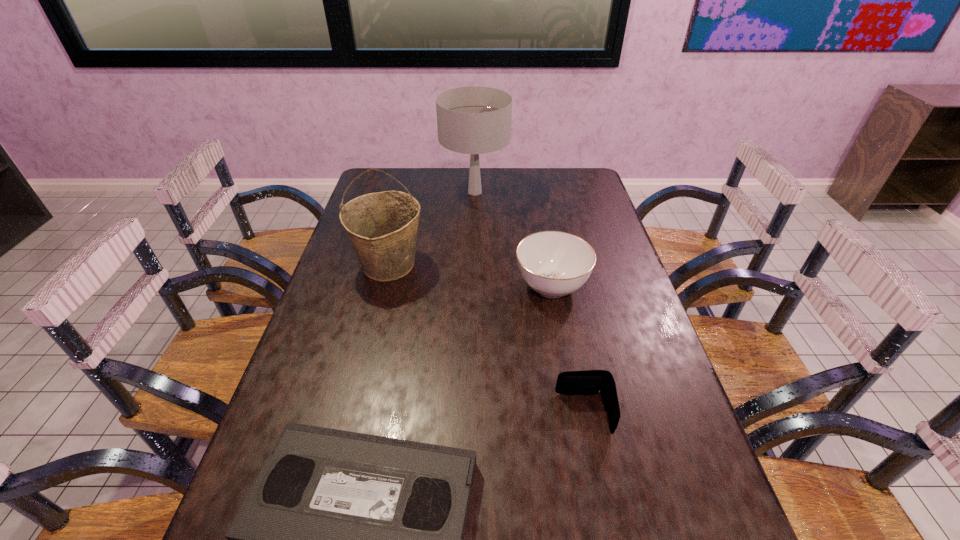
Locate an element on the screen. object that is at the far edge is located at coordinates (474, 120).

Where is `object at the left edge`? object at the left edge is located at coordinates (382, 227).

Find the location of a particular element. This screenshot has width=960, height=540. chinaware present at the right edge is located at coordinates (554, 264).

Locate an element on the screen. Image resolution: width=960 pixels, height=540 pixels. wallet that is positioned at the right edge is located at coordinates (590, 382).

Identify the location of vacant space at the far edge of the desktop. This screenshot has height=540, width=960. (462, 176).

In the image, there is a desktop. Find the location of `vacant space at the left edge`. vacant space at the left edge is located at coordinates (294, 366).

You are a GUI agent. You are given a task and a screenshot of the screen. Output one action in this format:
    pyautogui.click(x=<x>, y=<y>)
    Task: Click on the vacant space at the right edge
    This screenshot has width=960, height=540.
    Given the screenshot: What is the action you would take?
    pyautogui.click(x=574, y=210)

Find the location of a particular element. vacant space at the far right corner of the desktop is located at coordinates (558, 180).

This screenshot has width=960, height=540. I want to click on free point between the fourth tallest object and the chinaware, so click(x=567, y=350).

You are a GUI agent. You are given a task and a screenshot of the screen. Output one action in this format:
    pyautogui.click(x=<x>, y=<y>)
    Task: Click on the free spot between the fourth tallest object and the farthest object
    This screenshot has width=960, height=540.
    Given the screenshot: What is the action you would take?
    pyautogui.click(x=530, y=302)